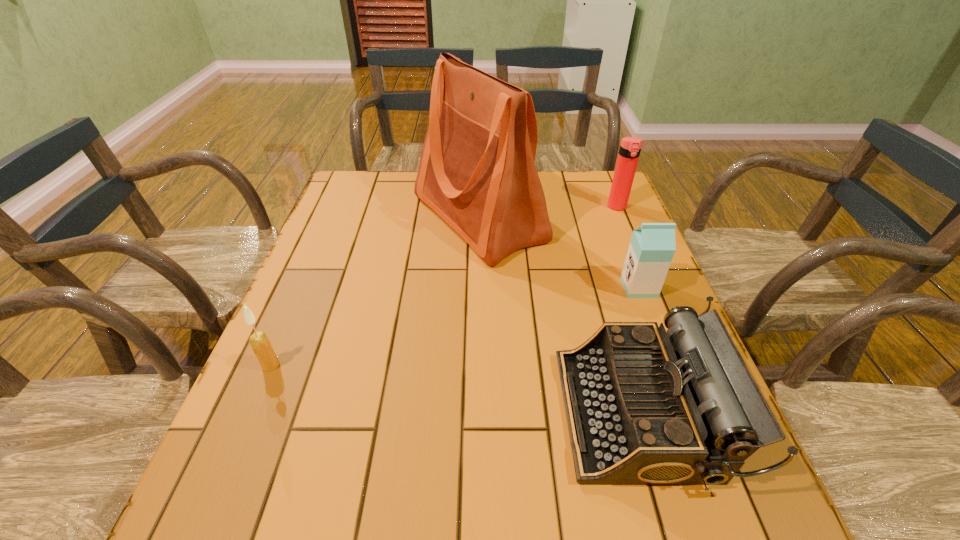
I want to click on object located at the near right corner, so pos(644,406).

In order to click on vacant point at the far edge in this screenshot , I will do `click(397, 203)`.

In the image, there is a desktop. At what (x,y) coordinates should I click in order to perform the action: click on free space at the near edge. Please return your answer as a coordinate pair (x, y). The width and height of the screenshot is (960, 540). Looking at the image, I should click on (453, 490).

I want to click on vacant position at the left edge of the desktop, so click(204, 484).

Where is `free space at the right edge`? Image resolution: width=960 pixels, height=540 pixels. free space at the right edge is located at coordinates (596, 232).

Locate an element on the screen. vacant region at the near left corner of the desktop is located at coordinates (208, 496).

Find the location of a particular element. free location at the far right corner of the desktop is located at coordinates (581, 181).

The image size is (960, 540). I want to click on vacant area that lies between the shopping bag and the typewriter, so click(560, 316).

The width and height of the screenshot is (960, 540). Find the location of `unoccupied position between the shopping bag and the leftmost object`. unoccupied position between the shopping bag and the leftmost object is located at coordinates (374, 292).

Locate an element on the screen. The width and height of the screenshot is (960, 540). free space that is in between the tallest object and the third nearest object is located at coordinates (559, 253).